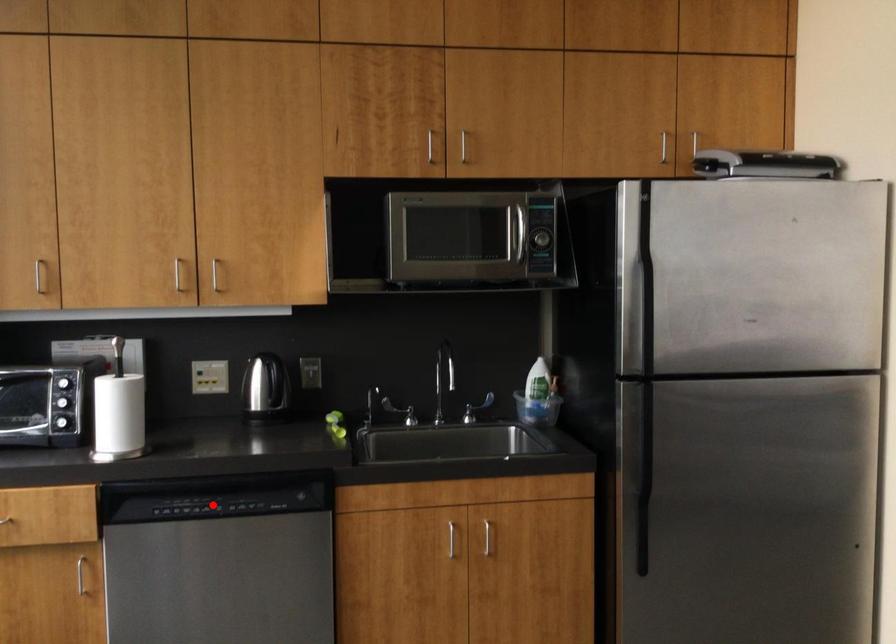
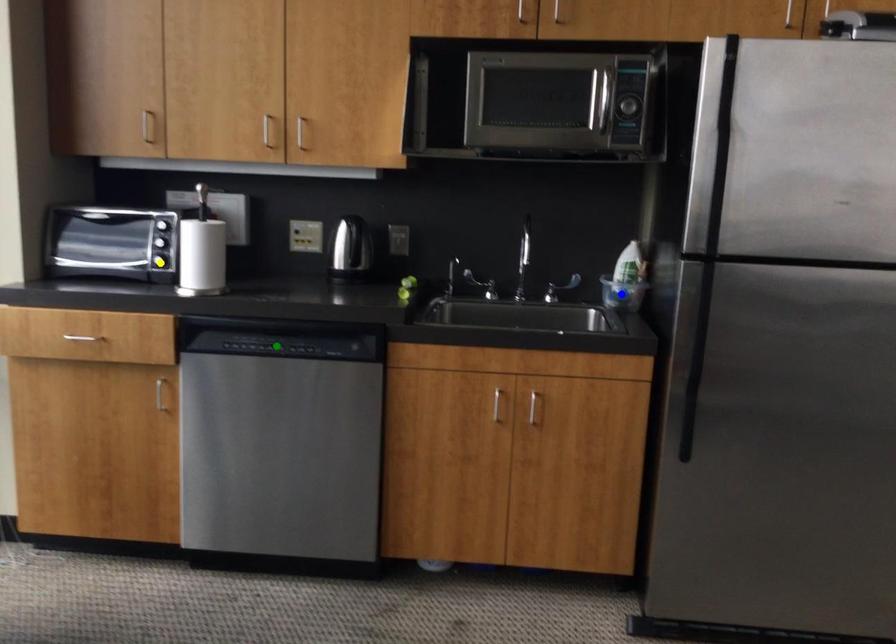
Question: I am providing you with two images of the same scene from different viewpoints. A red point is marked on the first image. You are given multiple points on the second image. Which mark in image 2 goes with the point in image 1?

Choices:
 (A) green point
 (B) blue point
 (C) yellow point

Answer: (A)